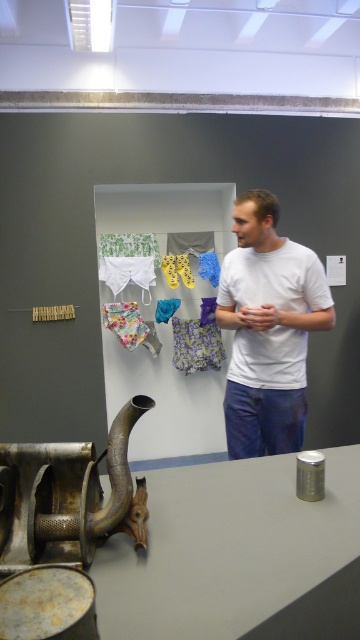
You are an art curator standing 1.5 meters away from the camera position. You want to place a new sculpture that is 1.2 meters tall on the floor near the rusty metal sculpture at lower left. Will the new sculpture be visible from your current position?

The distance between the rusty metal sculpture at lower left and the camera is 1.03 meters. Since you are standing 1.5 meters away from the camera, the total distance between you and the rusty metal sculpture at lower left is 2.53 meters. The new sculpture is 1.2 meters tall, so it should be visible from that distance as long as there are no obstructions.

You are an art curator standing in front of the gallery wall. You notice two points marked on the wall display board. The first point is at coordinates point (290, 307) and the second is at point (181, 349). Which point is closer to you?

Point (290, 307) is in front of point (181, 349), so it is closer to you.